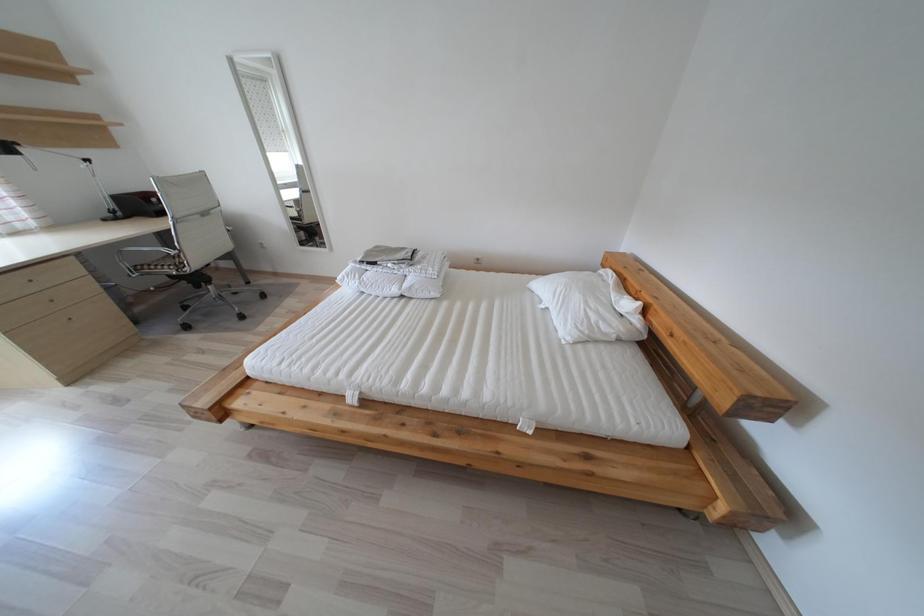
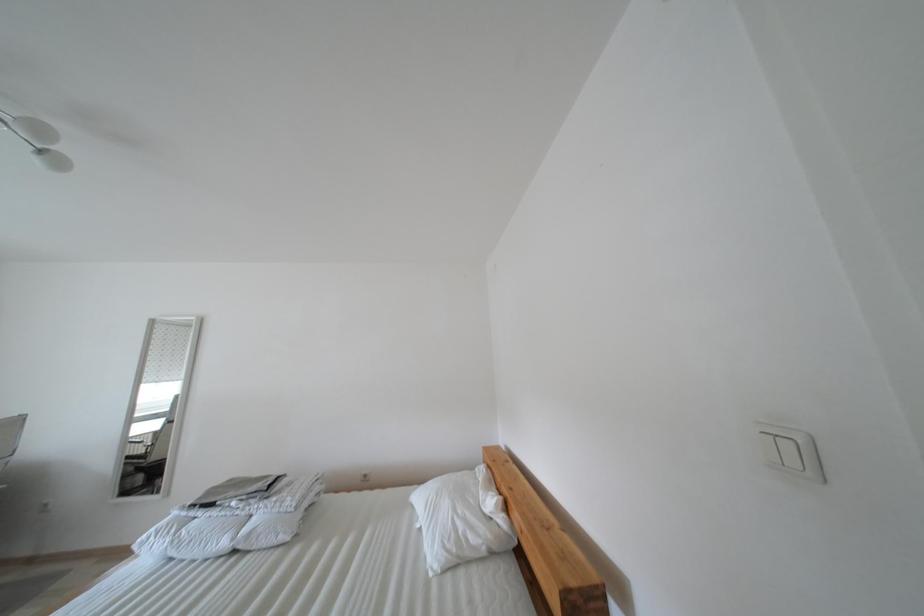
The first image is from the beginning of the video and the second image is from the end. How did the camera likely rotate when shooting the video?

The rotation direction of the camera is right-up.